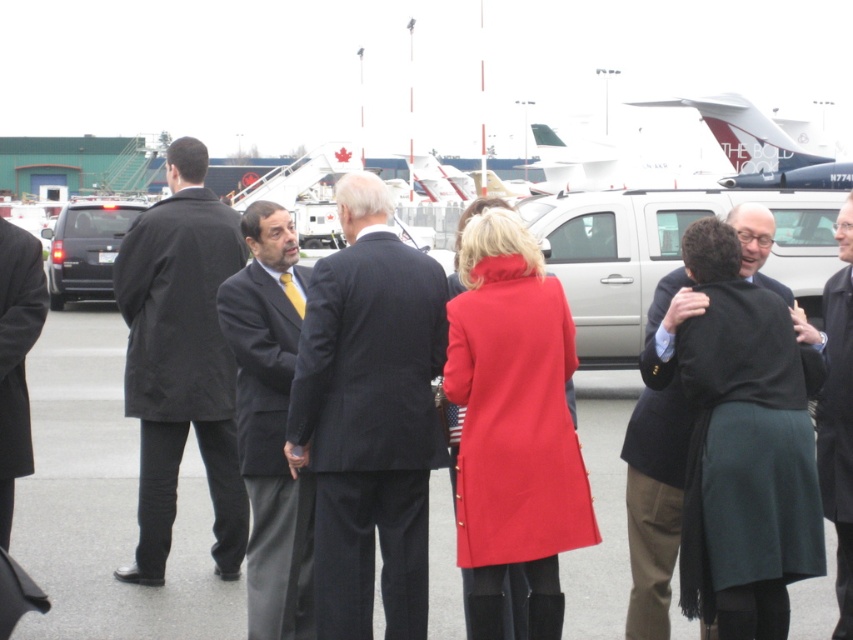
You are a photographer trying to capture a group photo of the black coat at center and the white glossy airplane at upper center. Based on their heights, which one will appear taller in the photo?

The white glossy airplane at upper center will appear taller in the photo because it is taller than the black coat at center.

You are a photographer trying to capture a photo of the white glossy airplane at upper center without including the black coat at center in the frame. Based on their positions, is this possible?

The black coat at center is to the left of the white glossy airplane at upper center. Since the black coat is positioned to the left of the airplane, you can adjust your camera angle to the right side of the airplane to exclude the black coat at center from the frame.

You are a photographer trying to capture a photo of the silver metallic suv at right and the black coat at center. Since you want both subjects to be clearly visible in the frame, will you need to adjust your camera angle upwards or downwards?

The silver metallic suv at right is located above the black coat at center, so to capture both subjects clearly, you would need to adjust your camera angle downwards to focus on the lower area where the black coat at center is positioned while still including the suv at right.